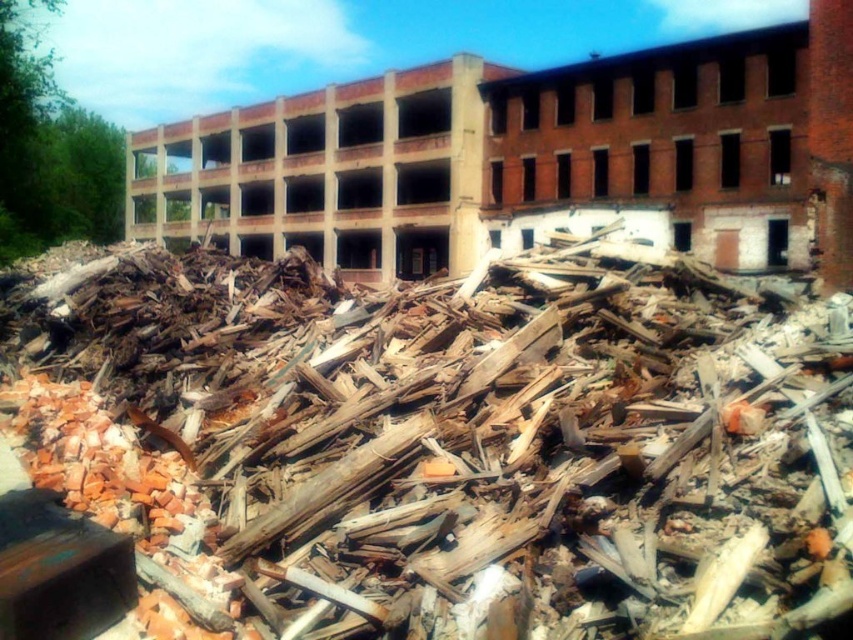
Looking at this image, you are a construction worker assessing the debris pile in the image. You need to determine the order of materials to clear first. Which material is located above the other between the brown wood debris at center and the brick rubble at center?

The brick rubble at center is located above the brown wood debris at center, so you should clear the brick rubble at center first before accessing the brown wood debris at center underneath.